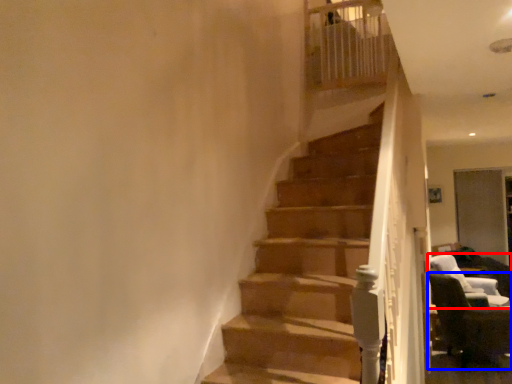
Question: Which of the following is the farthest to the observer, chair (highlighted by a red box) or chair (highlighted by a blue box)?

Choices:
 (A) chair
 (B) chair

Answer: (A)